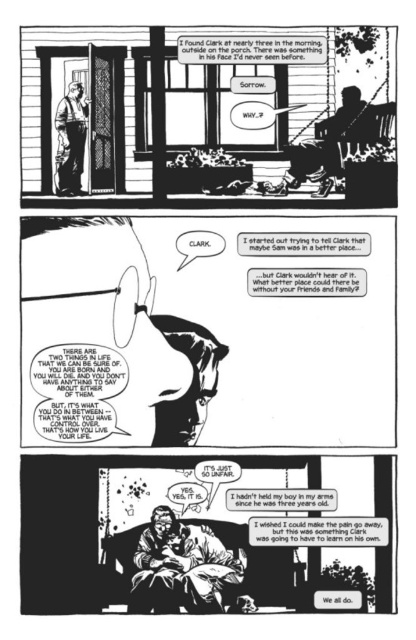
In the top panel of the comic strip, there are two points labeled as point A and point B. Point A is located at coordinates (126, 296) and Point B is at (237, 588). Based on the scene description, which point is closer to the viewer?

Point B at (237, 588) is closer to the viewer because the description states that point A is further to the camera than point B.

You are a detective investigating a mysterious case. You arrive at the scene and observe the top panel of the comic strip described. You need to determine the distance between the smooth glass eye at center and the matte black baby at center. Can you confirm if the distance is more than 7 inches?

The smooth glass eye at center and the matte black baby at center are 7.89 inches apart, which is more than 7 inches.

Based on the comic strip scene, which object is positioned to the left of the other between the smooth glass eye at center and the matte black baby at center?

The smooth glass eye at center is positioned to the left of the matte black baby at center.